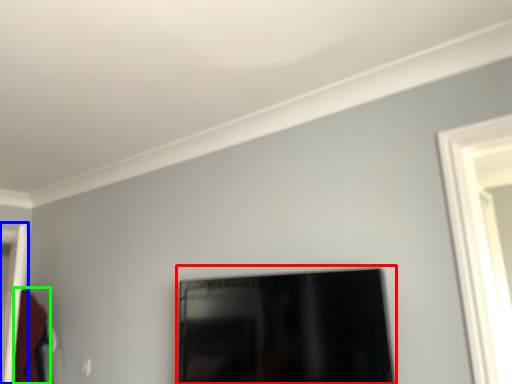
Question: Considering the real-world distances, which object is closest to picture frame (highlighted by a red box)? door (highlighted by a blue box) or robe (highlighted by a green box).

Choices:
 (A) door
 (B) robe

Answer: (B)